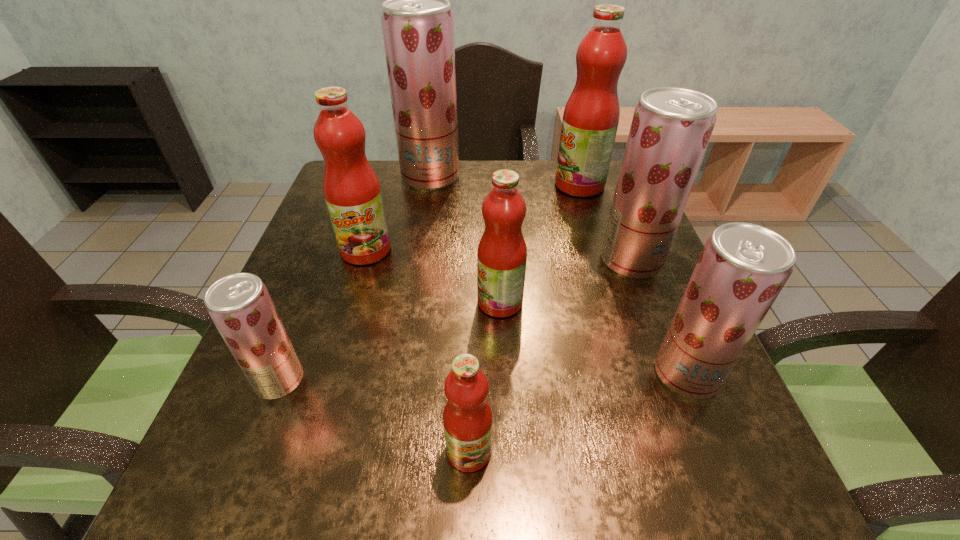
The image size is (960, 540). In order to click on vacant area at the far left corner in this screenshot , I will do `click(386, 164)`.

Locate an element on the screen. The height and width of the screenshot is (540, 960). vacant region between the leftmost strawberry fruit juice and the leftmost pink fruit juice is located at coordinates (323, 315).

At what (x,y) coordinates should I click in order to perform the action: click on vacant point located between the third strawberry fruit juice from right to left and the smallest strawberry fruit juice. Please return your answer as a coordinate pair (x, y). The width and height of the screenshot is (960, 540). Looking at the image, I should click on (355, 278).

Identify the location of vacant area between the second farthest pink fruit juice and the biggest pink fruit juice. Image resolution: width=960 pixels, height=540 pixels. (472, 218).

Find the location of a particular element. vacant space that's between the second nearest pink fruit juice and the second smallest strawberry fruit juice is located at coordinates (593, 338).

Where is `vacant area that lies between the rightmost pink fruit juice and the second biggest strawberry fruit juice`? The height and width of the screenshot is (540, 960). vacant area that lies between the rightmost pink fruit juice and the second biggest strawberry fruit juice is located at coordinates (606, 222).

Find the location of a particular element. unoccupied area between the leftmost strawberry fruit juice and the biggest pink fruit juice is located at coordinates (429, 282).

At what (x,y) coordinates should I click in order to perform the action: click on empty space between the third smallest pink fruit juice and the rightmost pink fruit juice. Please return your answer as a coordinate pair (x, y). The height and width of the screenshot is (540, 960). Looking at the image, I should click on (472, 218).

Identify the location of vacant area that lies between the third biggest strawberry fruit juice and the third strawberry fruit juice from right to left. The image size is (960, 540). (559, 275).

Find the location of `vacant area that lies between the leftmost pink fruit juice and the farthest strawberry fruit juice`. vacant area that lies between the leftmost pink fruit juice and the farthest strawberry fruit juice is located at coordinates (398, 213).